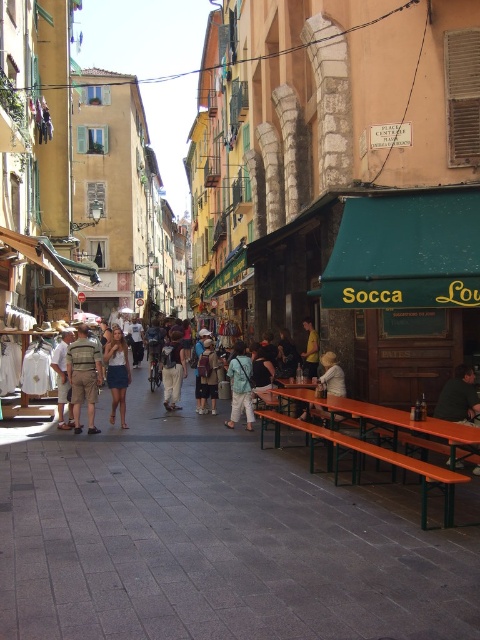
Between light blue denim pants at center and light brown leather shorts at center, which one has less height?

Standing shorter between the two is light blue denim pants at center.

Is light blue denim pants at center shorter than light brown leather shorts at center?

Indeed, light blue denim pants at center has a lesser height compared to light brown leather shorts at center.

You are a GUI agent. You are given a task and a screenshot of the screen. Output one action in this format:
    pyautogui.click(x=<x>, y=<y>)
    Task: Click on the light blue denim pants at center
    
    Given the screenshot: What is the action you would take?
    pyautogui.click(x=240, y=387)

Between denim skirt at center and light beige pants at center, which one appears on the left side from the viewer's perspective?

Positioned to the left is denim skirt at center.

Is denim skirt at center behind light beige pants at center?

No.

Is point (117, 384) farther from camera compared to point (179, 330)?

That is False.

This screenshot has height=640, width=480. In order to click on denim skirt at center in this screenshot , I will do `click(117, 372)`.

Does denim skirt at center have a greater height compared to light brown leather shorts at center?

Yes.

Between point (110, 420) and point (62, 355), which one is positioned behind?

The point (110, 420) is behind.

Image resolution: width=480 pixels, height=640 pixels. Identify the location of denim skirt at center. (117, 372).